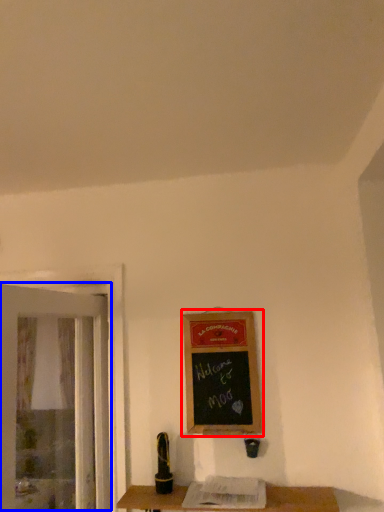
Question: Which object appears closest to the camera in this image, bulletin board (highlighted by a red box) or screen door (highlighted by a blue box)?

Choices:
 (A) bulletin board
 (B) screen door

Answer: (B)